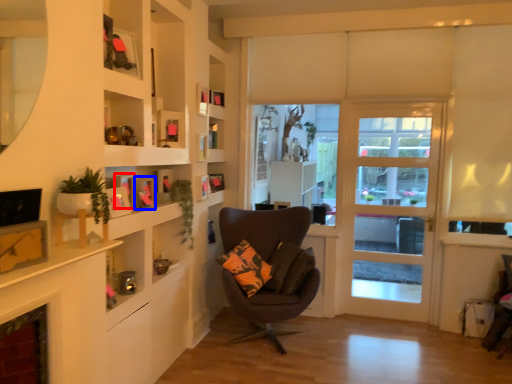
Question: Which object is closer to the camera taking this photo, picture frame (highlighted by a red box) or picture frame (highlighted by a blue box)?

Choices:
 (A) picture frame
 (B) picture frame

Answer: (A)